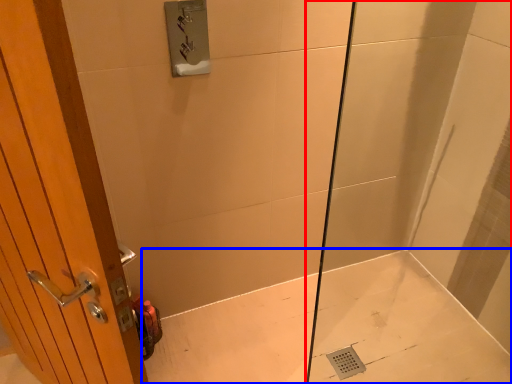
Question: Among these objects, which one is nearest to the camera, shower door (highlighted by a red box) or bath (highlighted by a blue box)?

Choices:
 (A) shower door
 (B) bath

Answer: (A)